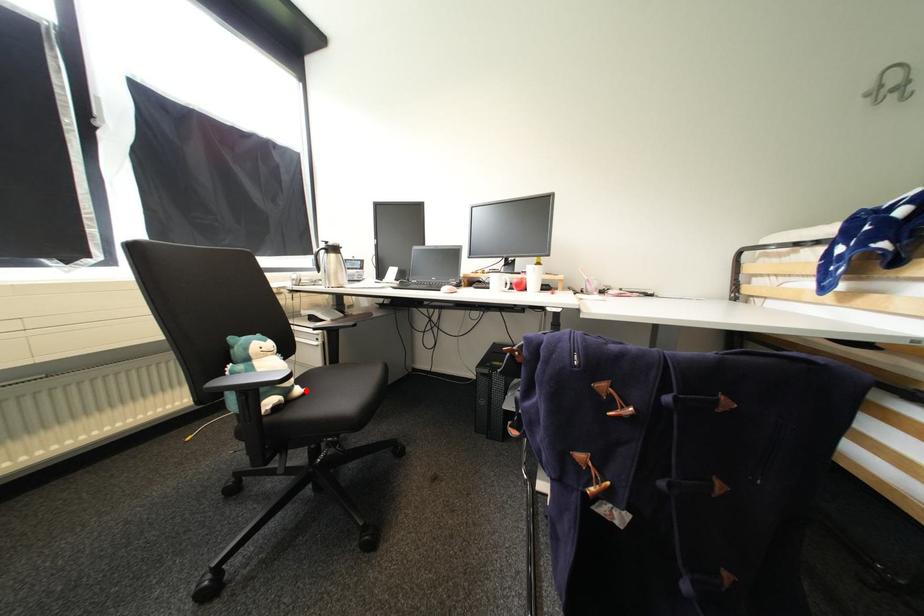
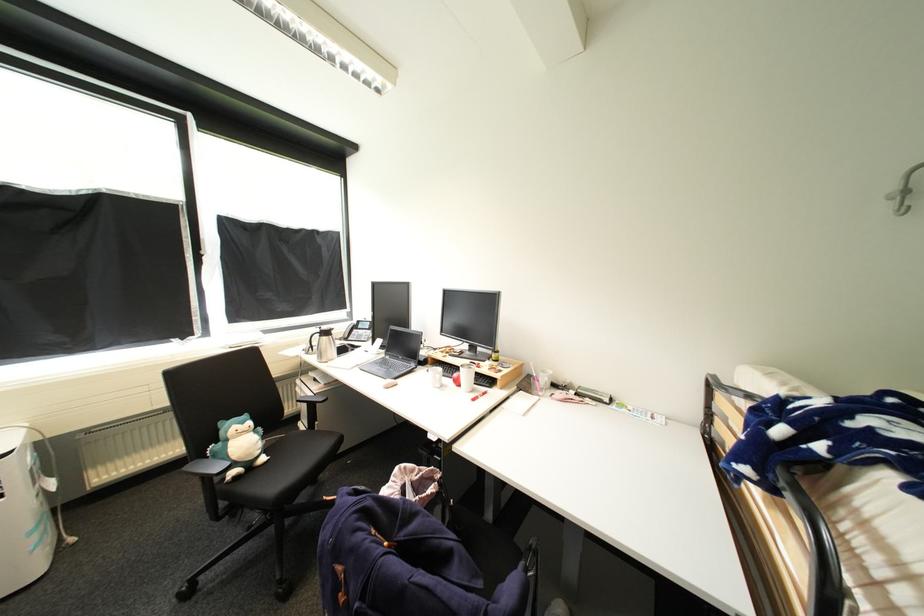
The point at the highlighted location is marked in the first image. Where is the corresponding point in the second image?

(270, 460)